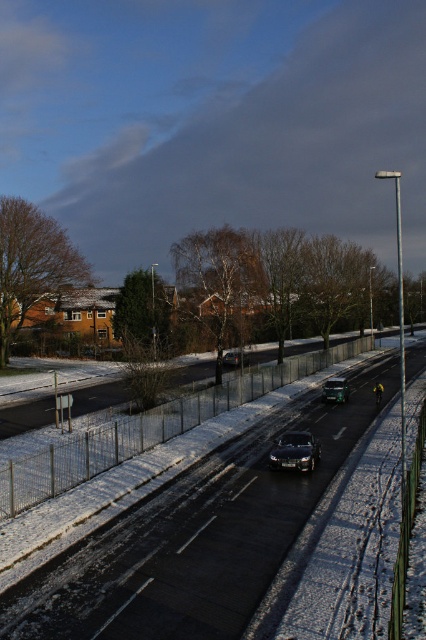
Question: Can you confirm if metallic silver car at center is bigger than shiny black sedan at center?

Choices:
 (A) no
 (B) yes

Answer: (A)

Question: Is black asphalt road at center below metallic silver car at center?

Choices:
 (A) yes
 (B) no

Answer: (A)

Question: Among these objects, which one is nearest to the camera?

Choices:
 (A) shiny black sedan at center
 (B) shiny black car at center
 (C) metallic silver car at center

Answer: (B)

Question: Which point appears farthest from the camera in this image?

Choices:
 (A) [x=345, y=388]
 (B) [x=267, y=582]
 (C) [x=302, y=448]

Answer: (A)

Question: Can you confirm if black asphalt road at center is wider than metallic silver car at center?

Choices:
 (A) yes
 (B) no

Answer: (A)

Question: Among these objects, which one is farthest from the camera?

Choices:
 (A) shiny black sedan at center
 (B) metallic silver car at center

Answer: (A)